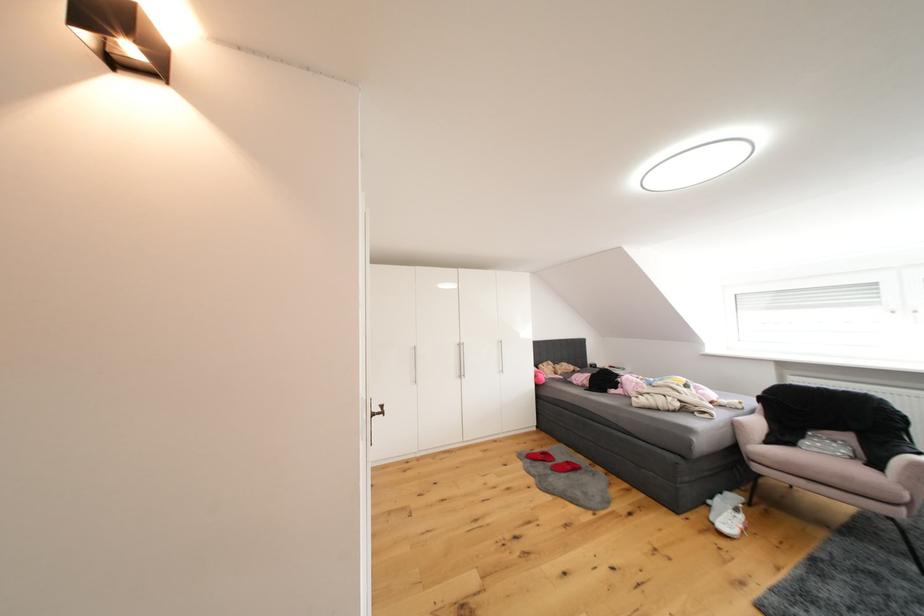
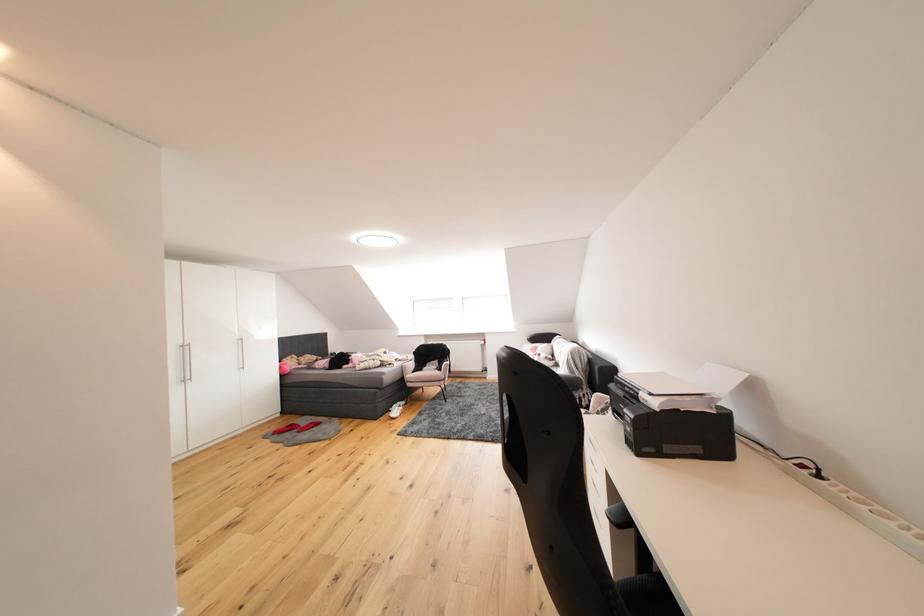
Where in the second image is the point corresponding to point (569, 456) from the first image?

(313, 424)